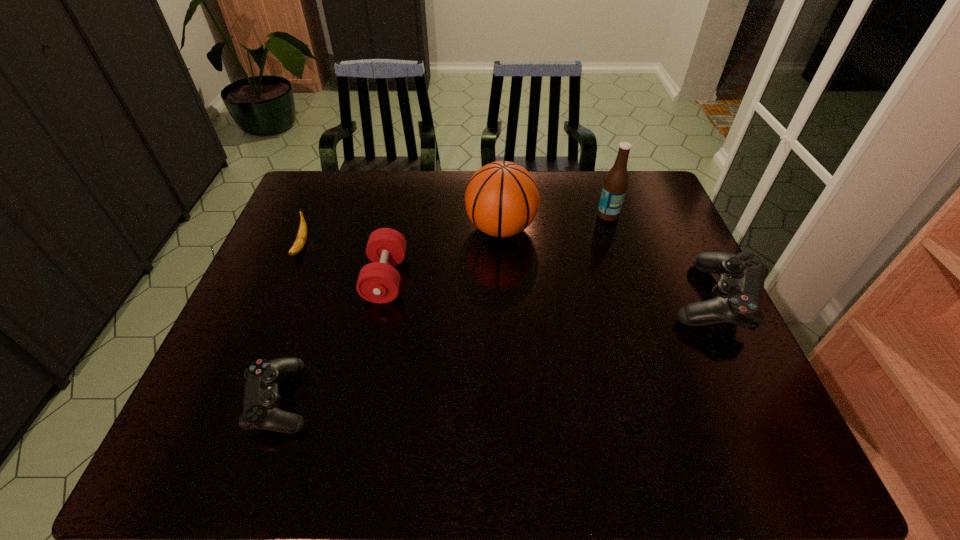
Identify the location of free space that satisfies the following two spatial constraints: 1. on the peel of the banana from the top; 2. on the left side of the dumbbell. The height and width of the screenshot is (540, 960). (288, 279).

Find the location of a particular element. Image resolution: width=960 pixels, height=540 pixels. vacant space that satisfies the following two spatial constraints: 1. on the peel of the leftmost object from the top; 2. on the left side of the taller control is located at coordinates (279, 299).

What are the coordinates of `free point that satisfies the following two spatial constraints: 1. on the back side of the fifth object from right to left; 2. on the left side of the dumbbell` in the screenshot? It's located at (323, 279).

You are a GUI agent. You are given a task and a screenshot of the screen. Output one action in this format:
    pyautogui.click(x=<x>, y=<y>)
    Task: Click on the free region that satisfies the following two spatial constraints: 1. on the front side of the fourth object from left to right; 2. on the right side of the right control
    The height and width of the screenshot is (540, 960).
    Given the screenshot: What is the action you would take?
    pyautogui.click(x=504, y=299)

The width and height of the screenshot is (960, 540). Identify the location of vacant point that satisfies the following two spatial constraints: 1. on the peel of the leftmost object from the top; 2. on the right side of the left control. (237, 399).